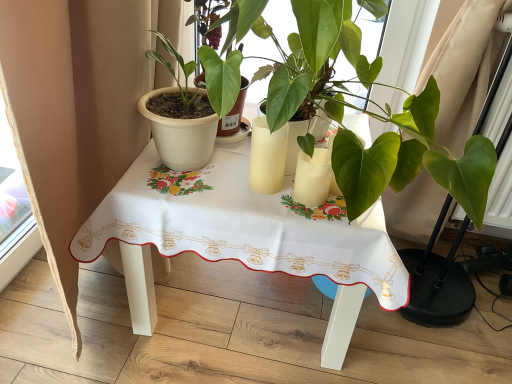
The width and height of the screenshot is (512, 384). Describe the element at coordinates (180, 117) in the screenshot. I see `matte white pot at left, which ranks as the second houseplant in right-to-left order` at that location.

You are a GUI agent. You are given a task and a screenshot of the screen. Output one action in this format:
    pyautogui.click(x=<x>, y=<y>)
    Task: Click on the matte white pot at left, the first houseplant viewed from the left
    Image resolution: width=512 pixels, height=384 pixels.
    Given the screenshot: What is the action you would take?
    pyautogui.click(x=180, y=117)

Identify the location of matte yellow glass at center, the second candle holder in the right-to-left sequence. This screenshot has height=384, width=512. [x=267, y=157].

I want to click on matte white candle at center, the second candle holder in the left-to-right sequence, so click(x=312, y=178).

From a real-world perspective, who is located lower, green matte plant at center, which ranks as the 2th houseplant in left-to-right order, or matte white candle at center, positioned as the 1th candle holder in right-to-left order?

matte white candle at center, positioned as the 1th candle holder in right-to-left order, is physically lower.

Which of these two, green matte plant at center, which ranks as the 2th houseplant in left-to-right order, or matte white candle at center, positioned as the 1th candle holder in right-to-left order, is wider?

green matte plant at center, which ranks as the 2th houseplant in left-to-right order, is wider.

From the picture: Does green matte plant at center, which ranks as the 2th houseplant in left-to-right order, lie behind matte white candle at center, positioned as the 1th candle holder in right-to-left order?

That is False.

Is green matte plant at center, which ranks as the 2th houseplant in left-to-right order, facing towards white fabric table at center?

No, green matte plant at center, which ranks as the 2th houseplant in left-to-right order, is not aimed at white fabric table at center.

From a real-world perspective, relative to white fabric table at center, is green matte plant at center, positioned as the 1th houseplant in right-to-left order, vertically above or below?

green matte plant at center, positioned as the 1th houseplant in right-to-left order, is above white fabric table at center.

How distant is green matte plant at center, which ranks as the 2th houseplant in left-to-right order, from white fabric table at center?

green matte plant at center, which ranks as the 2th houseplant in left-to-right order, is 26.50 centimeters away from white fabric table at center.

Can you tell me how much matte yellow glass at center, placed as the 1th candle holder when sorted from left to right, and matte white pot at left, the first houseplant viewed from the left, differ in facing direction?

They differ by 5.28 degrees in their facing directions.

Does matte yellow glass at center, the second candle holder in the right-to-left sequence, lie behind matte white pot at left, which ranks as the second houseplant in right-to-left order?

Yes.

You are a GUI agent. You are given a task and a screenshot of the screen. Output one action in this format:
    pyautogui.click(x=<x>, y=<y>)
    Task: Click on the 1st candle holder positioned below the matte white pot at left, the first houseplant viewed from the left (from a real-world perspective)
    This screenshot has height=384, width=512.
    Given the screenshot: What is the action you would take?
    pyautogui.click(x=267, y=157)

Is matte yellow glass at center, the second candle holder in the right-to-left sequence, with matte white pot at left, the first houseplant viewed from the left?

No, matte yellow glass at center, the second candle holder in the right-to-left sequence, is not making contact with matte white pot at left, the first houseplant viewed from the left.

Considering the positions of objects matte white candle at center, positioned as the 1th candle holder in right-to-left order, and matte white pot at left, the first houseplant viewed from the left, in the image provided, who is more to the right, matte white candle at center, positioned as the 1th candle holder in right-to-left order, or matte white pot at left, the first houseplant viewed from the left,?

matte white candle at center, positioned as the 1th candle holder in right-to-left order, is more to the right.

Is matte white candle at center, positioned as the 1th candle holder in right-to-left order, positioned with its back to matte white pot at left, which ranks as the second houseplant in right-to-left order?

That's not correct — matte white candle at center, positioned as the 1th candle holder in right-to-left order, is not looking away from matte white pot at left, which ranks as the second houseplant in right-to-left order.

From a real-world perspective, which object stands above the other?

matte white pot at left, the first houseplant viewed from the left.

Is matte white candle at center, positioned as the 1th candle holder in right-to-left order, wider or thinner than matte white pot at left, the first houseplant viewed from the left?

In the image, matte white candle at center, positioned as the 1th candle holder in right-to-left order, appears to be more narrow than matte white pot at left, the first houseplant viewed from the left.

Is point (173, 71) positioned after point (416, 138)?

No, it is not.

Could you tell me if matte white pot at left, the first houseplant viewed from the left, is turned towards green matte plant at center, which ranks as the 2th houseplant in left-to-right order?

No.

How different are the orientations of matte white pot at left, the first houseplant viewed from the left, and green matte plant at center, positioned as the 1th houseplant in right-to-left order, in degrees?

They differ by 0.000146 degrees in their facing directions.

Where is `houseplant above the green matte plant at center, positioned as the 1th houseplant in right-to-left order (from the image's perspective)`? houseplant above the green matte plant at center, positioned as the 1th houseplant in right-to-left order (from the image's perspective) is located at coordinates pyautogui.click(x=180, y=117).

In the image, is white fabric table at center positioned in front of or behind green matte plant at center, positioned as the 1th houseplant in right-to-left order?

white fabric table at center is behind green matte plant at center, positioned as the 1th houseplant in right-to-left order.

Which object is thinner, white fabric table at center or green matte plant at center, which ranks as the 2th houseplant in left-to-right order?

Thinner between the two is green matte plant at center, which ranks as the 2th houseplant in left-to-right order.

Where is `the 1st houseplant positioned above the white fabric table at center (from the image's perspective)`? This screenshot has height=384, width=512. the 1st houseplant positioned above the white fabric table at center (from the image's perspective) is located at coordinates (413, 160).

Considering the relative sizes of matte yellow glass at center, placed as the 1th candle holder when sorted from left to right, and white fabric table at center in the image provided, is matte yellow glass at center, placed as the 1th candle holder when sorted from left to right, bigger than white fabric table at center?

Incorrect, matte yellow glass at center, placed as the 1th candle holder when sorted from left to right, is not larger than white fabric table at center.

The image size is (512, 384). Identify the location of table on the left side of matte yellow glass at center, the second candle holder in the right-to-left sequence. (240, 238).

Considering the positions of objects matte yellow glass at center, the second candle holder in the right-to-left sequence, and white fabric table at center in the image provided, who is behind, matte yellow glass at center, the second candle holder in the right-to-left sequence, or white fabric table at center?

matte yellow glass at center, the second candle holder in the right-to-left sequence, is further from the camera.

From a real-world perspective, which houseplant is the 2nd one above the matte white candle at center, positioned as the 1th candle holder in right-to-left order? Please provide its 2D coordinates.

[(413, 160)]

Find the location of a particular element. table behind the green matte plant at center, which ranks as the 2th houseplant in left-to-right order is located at coordinates (240, 238).

Based on their spatial positions, is white fabric table at center or matte white candle at center, the second candle holder in the left-to-right sequence, further from green matte plant at center, which ranks as the 2th houseplant in left-to-right order?

white fabric table at center.

Consider the image. Based on their spatial positions, is green matte plant at center, positioned as the 1th houseplant in right-to-left order, or matte yellow glass at center, the second candle holder in the right-to-left sequence, closer to matte white pot at left, which ranks as the second houseplant in right-to-left order?

matte yellow glass at center, the second candle holder in the right-to-left sequence, is positioned closer to the anchor matte white pot at left, which ranks as the second houseplant in right-to-left order.

Estimate the real-world distances between objects in this image. Which object is further from matte white candle at center, positioned as the 1th candle holder in right-to-left order, matte yellow glass at center, the second candle holder in the right-to-left sequence, or matte white pot at left, the first houseplant viewed from the left?

matte white pot at left, the first houseplant viewed from the left, lies further to matte white candle at center, positioned as the 1th candle holder in right-to-left order, than the other object.

From the image, which object appears to be farther from matte yellow glass at center, the second candle holder in the right-to-left sequence, matte white pot at left, which ranks as the second houseplant in right-to-left order, or green matte plant at center, positioned as the 1th houseplant in right-to-left order?

green matte plant at center, positioned as the 1th houseplant in right-to-left order, lies further to matte yellow glass at center, the second candle holder in the right-to-left sequence, than the other object.

From the image, which object appears to be nearer to matte white pot at left, which ranks as the second houseplant in right-to-left order, green matte plant at center, positioned as the 1th houseplant in right-to-left order, or white fabric table at center?

white fabric table at center is closer to matte white pot at left, which ranks as the second houseplant in right-to-left order.

From the image, which object appears to be nearer to green matte plant at center, which ranks as the 2th houseplant in left-to-right order, matte white candle at center, the second candle holder in the left-to-right sequence, or white fabric table at center?

Among the two, matte white candle at center, the second candle holder in the left-to-right sequence, is located nearer to green matte plant at center, which ranks as the 2th houseplant in left-to-right order.

Based on their spatial positions, is green matte plant at center, positioned as the 1th houseplant in right-to-left order, or matte white pot at left, which ranks as the second houseplant in right-to-left order, further from matte yellow glass at center, the second candle holder in the right-to-left sequence?

Based on the image, green matte plant at center, positioned as the 1th houseplant in right-to-left order, appears to be further to matte yellow glass at center, the second candle holder in the right-to-left sequence.

Which object lies further to the anchor point matte white pot at left, which ranks as the second houseplant in right-to-left order, matte yellow glass at center, the second candle holder in the right-to-left sequence, or white fabric table at center?

The object further to matte white pot at left, which ranks as the second houseplant in right-to-left order, is white fabric table at center.

Locate an element on the screen. Image resolution: width=512 pixels, height=384 pixels. table between green matte plant at center, positioned as the 1th houseplant in right-to-left order, and matte white candle at center, positioned as the 1th candle holder in right-to-left order, from front to back is located at coordinates (240, 238).

Image resolution: width=512 pixels, height=384 pixels. I want to click on table between green matte plant at center, which ranks as the 2th houseplant in left-to-right order, and matte yellow glass at center, placed as the 1th candle holder when sorted from left to right, from front to back, so click(240, 238).

The image size is (512, 384). What are the coordinates of `table between matte white pot at left, which ranks as the second houseplant in right-to-left order, and green matte plant at center, positioned as the 1th houseplant in right-to-left order` in the screenshot? It's located at (240, 238).

Find the location of a particular element. This screenshot has width=512, height=384. candle holder between matte yellow glass at center, placed as the 1th candle holder when sorted from left to right, and white fabric table at center vertically is located at coordinates [312, 178].